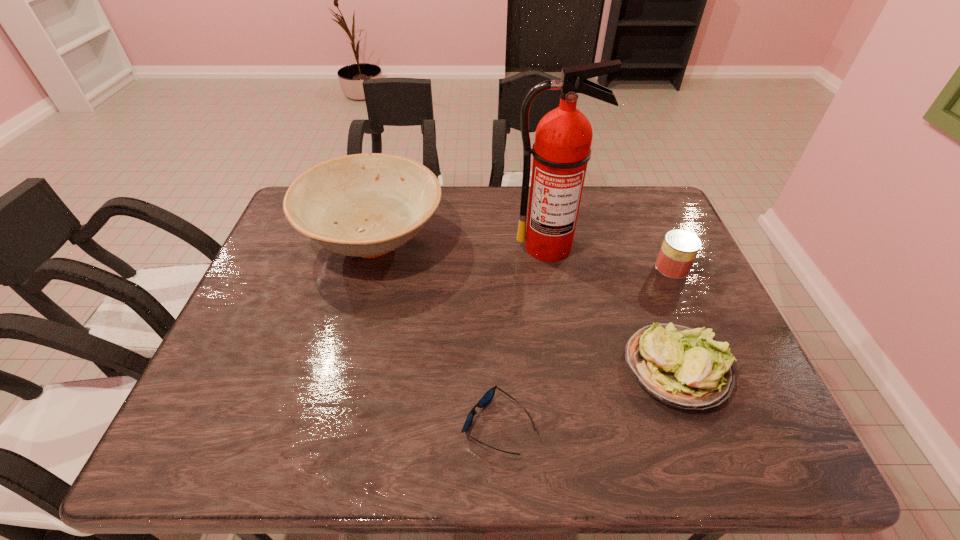
Locate an element on the screen. This screenshot has height=540, width=960. blank space at the near edge is located at coordinates (293, 433).

Image resolution: width=960 pixels, height=540 pixels. What are the coordinates of `vacant space at the left edge` in the screenshot? It's located at (301, 239).

In the image, there is a desktop. At what (x,y) coordinates should I click in order to perform the action: click on free space at the right edge. Please return your answer as a coordinate pair (x, y). This screenshot has height=540, width=960. Looking at the image, I should click on (717, 310).

This screenshot has height=540, width=960. I want to click on vacant space at the far right corner, so click(x=657, y=224).

At what (x,y) coordinates should I click in order to perform the action: click on vacant point located between the lettuce and the fire extinguisher. Please return your answer as a coordinate pair (x, y). Looking at the image, I should click on (612, 307).

You are a GUI agent. You are given a task and a screenshot of the screen. Output one action in this format:
    pyautogui.click(x=<x>, y=<y>)
    Task: Click on the unoccupied area between the second shortest object and the shortest object
    
    Given the screenshot: What is the action you would take?
    pyautogui.click(x=587, y=396)

Where is `vacant space that's between the tallest object and the can`? The width and height of the screenshot is (960, 540). vacant space that's between the tallest object and the can is located at coordinates pos(611,257).

Where is `free point between the fourth shortest object and the lettuce`? This screenshot has height=540, width=960. free point between the fourth shortest object and the lettuce is located at coordinates (525, 304).

Image resolution: width=960 pixels, height=540 pixels. I want to click on vacant area that lies between the shortest object and the leftmost object, so click(x=436, y=333).

Identify the location of free space between the dish and the can. (523, 254).